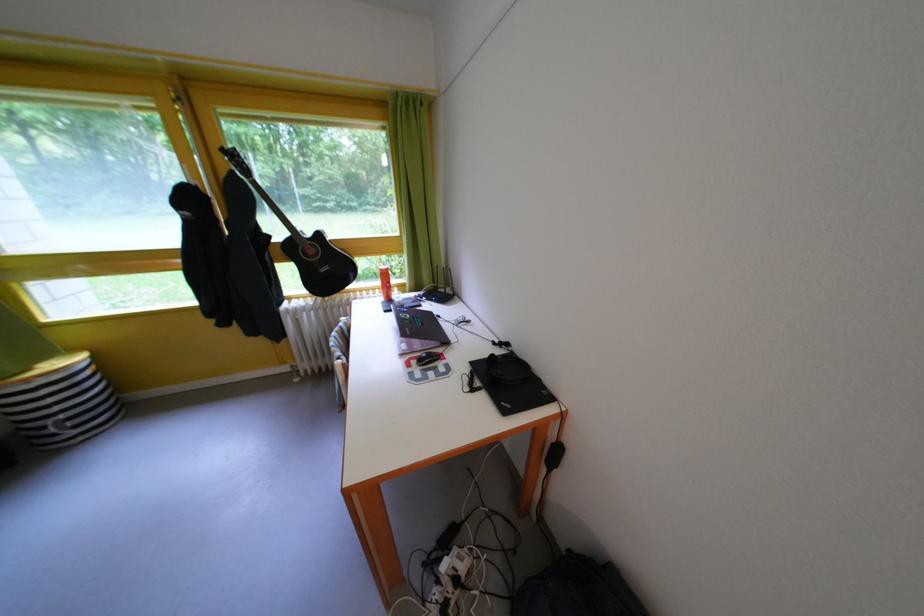
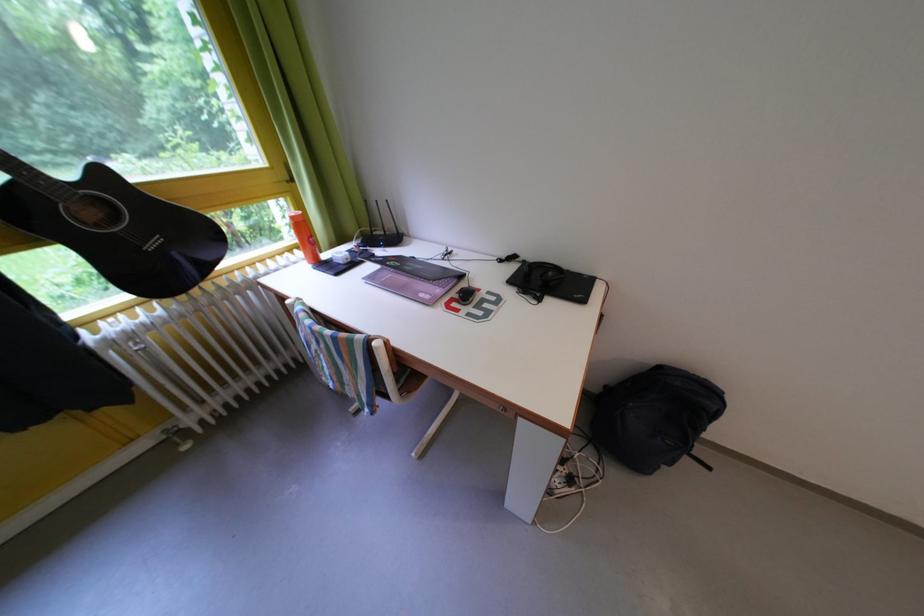
Find the pixel in the second image that matches [521,358] in the first image.

(533, 267)